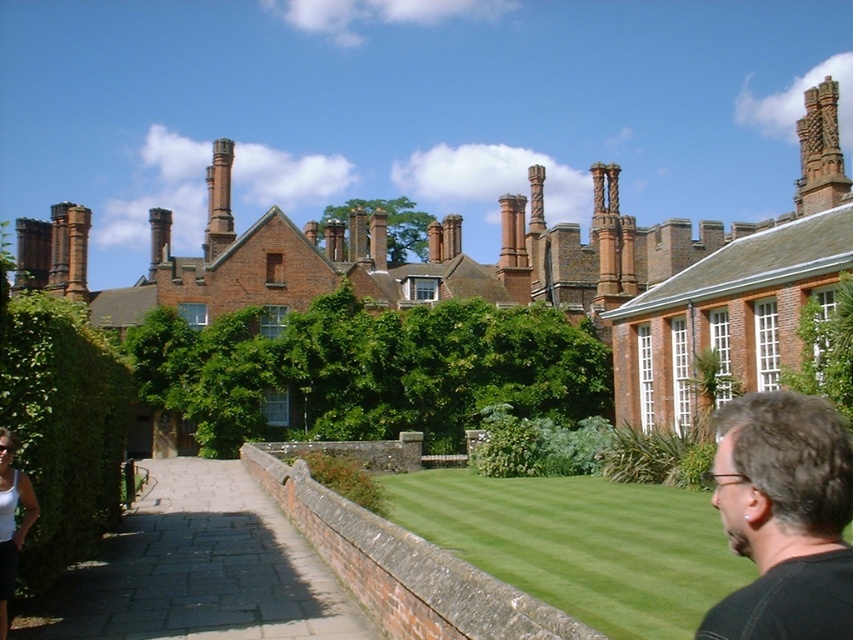
Question: Which of the following is the closest to the observer?

Choices:
 (A) (210, 216)
 (B) (824, 188)

Answer: (B)

Question: Which object is closer to the camera taking this photo?

Choices:
 (A) dark brown hair at lower right
 (B) brown textured chimney at upper right

Answer: (A)

Question: Does green grass at center have a greater width compared to brown textured chimney at upper right?

Choices:
 (A) yes
 (B) no

Answer: (B)

Question: Based on their relative distances, which object is farther from the brown textured chimney at upper right?

Choices:
 (A) white fabric at lower left
 (B) green grass at center

Answer: (A)

Question: Is brown textured chimney at upper right wider than smooth brick chimney at upper center?

Choices:
 (A) yes
 (B) no

Answer: (A)

Question: Does white fabric at lower left appear over smooth brick chimney at upper center?

Choices:
 (A) no
 (B) yes

Answer: (A)